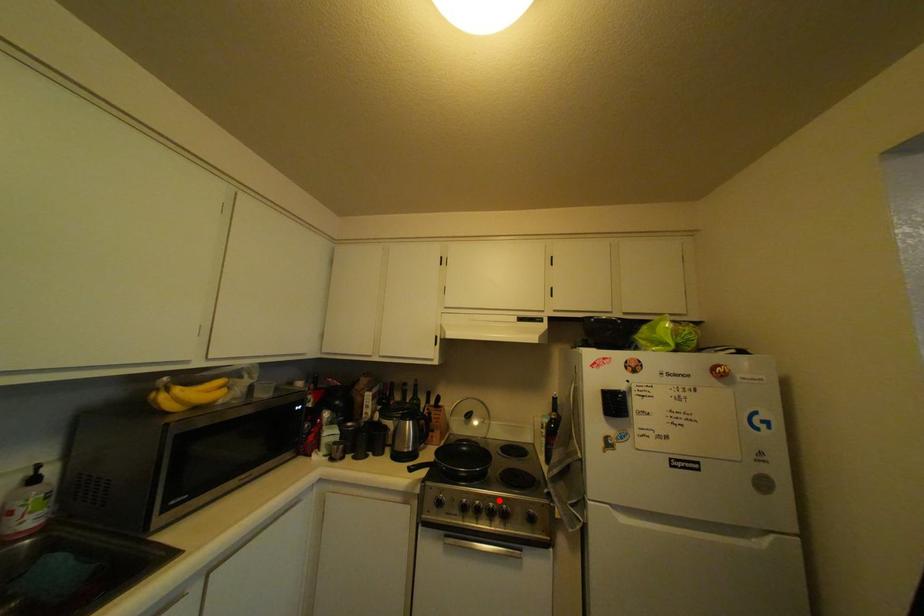
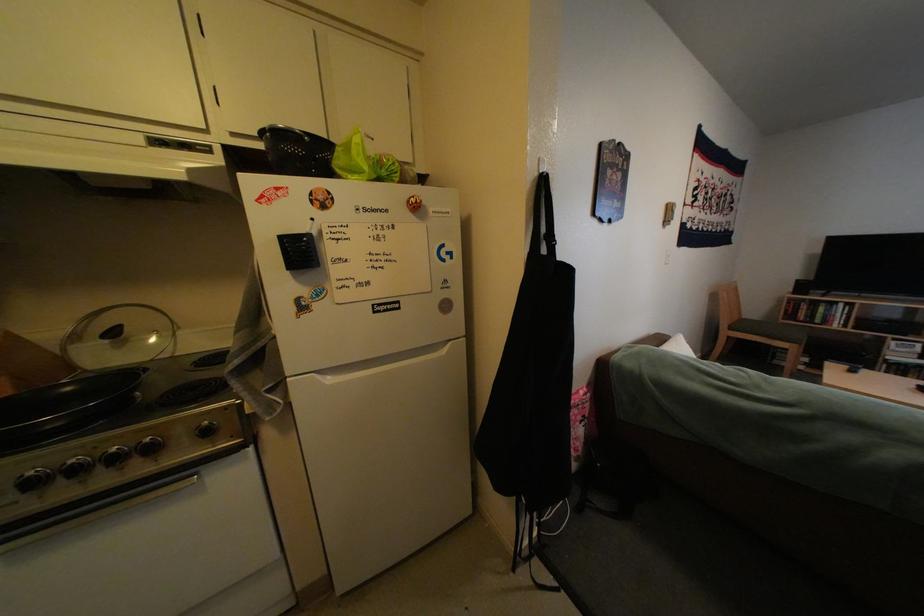
Locate, in the second image, the point that corresponds to the highlighted location in the first image.

(110, 448)